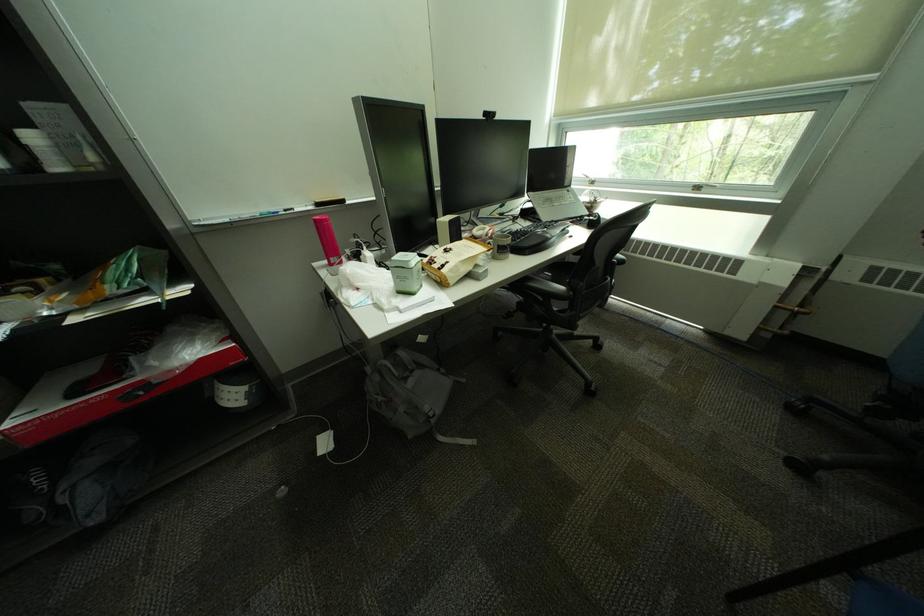
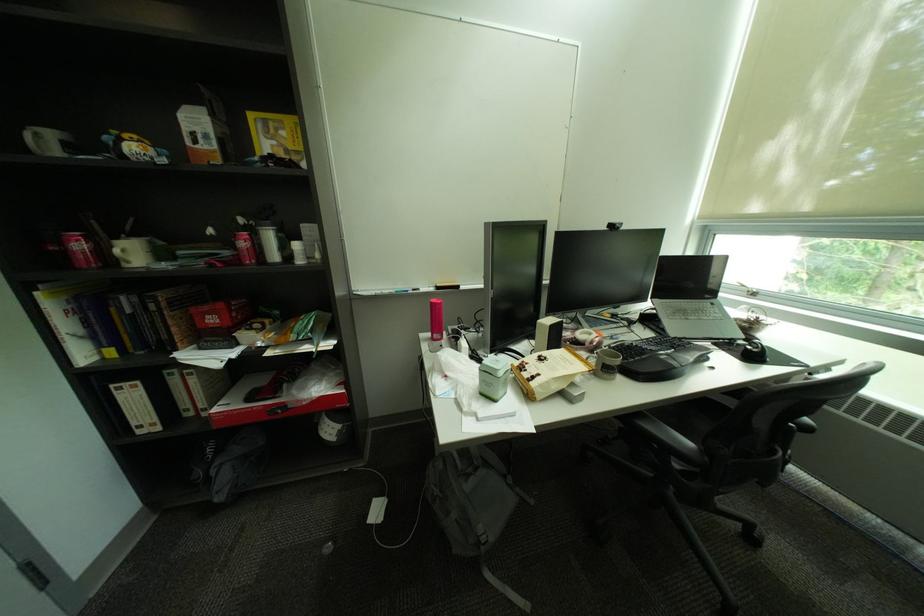
Where in the second image is the point corresponding to point 605,220 from the first image?

(766, 352)